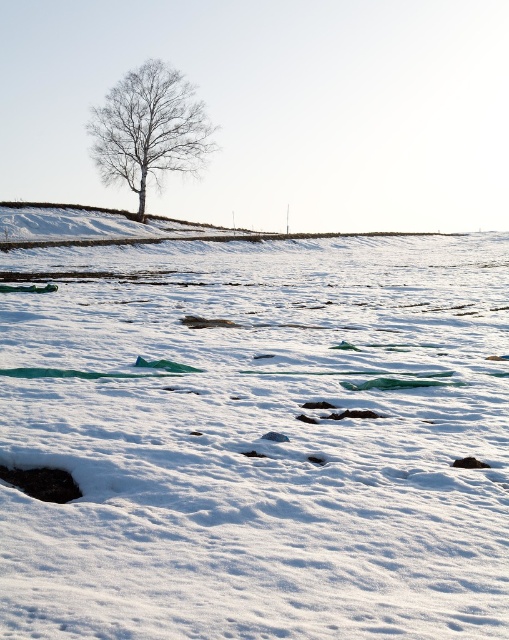
You are an environmental scientist analyzing the winter landscape. You observe the white powdery snow at center and the bare white tree at center. Which object is taller in this scene?

The white powdery snow at center is not as tall as the bare white tree at center, so the bare white tree at center is taller.

You are an observer standing in the winter landscape. You notice the white powdery snow at center and the bare white tree at center. Which one is nearer to you?

The white powdery snow at center is closer to the viewer than the bare white tree at center.